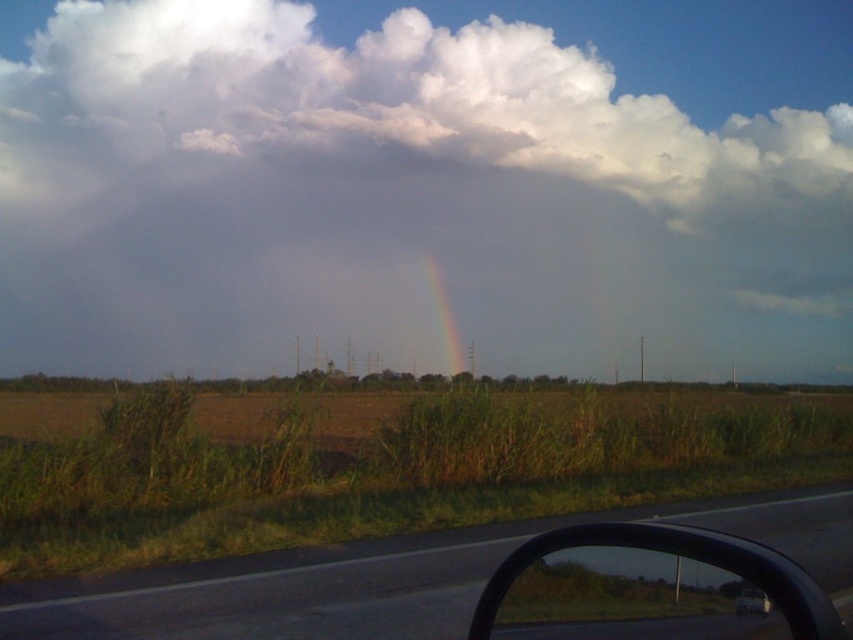
You are a delivery driver who needs to check if your white glossy car at lower right can fit through a narrow alley that is 12 inches wide. You see the transparent glass car window at lower right in your side mirror. Can you estimate if your car will fit through the alley?

The transparent glass car window at lower right is 11.36 inches from the white glossy car at lower right. Since the alley is 12 inches wide, the car can fit through the alley as there is enough space between the window and the car.

You are a photographer trying to capture both the white fluffy cloud at upper center and the rainbow at center in a single shot. Given that your camera has a maximum zoom range of 10 meters, can you fit both objects into the frame without moving the camera?

The white fluffy cloud at upper center and rainbow at center are 16.77 meters apart from each other. Since the camera can only zoom up to 10 meters, it cannot capture both objects in a single frame without moving the camera.

In the scene shown: You are a passenger in the car and looking out the window. Which object, the transparent glass car window at lower right or the white glossy car at lower right, takes up more space in your view?

The transparent glass car window at lower right takes up more space in your view because it is bigger than the white glossy car at lower right according to the description.